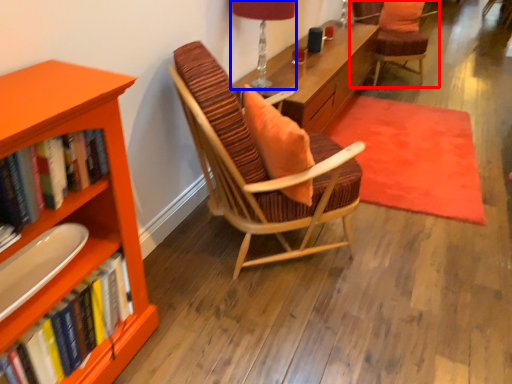
Question: Among these objects, which one is farthest to the camera, chair (highlighted by a red box) or table lamp (highlighted by a blue box)?

Choices:
 (A) chair
 (B) table lamp

Answer: (A)